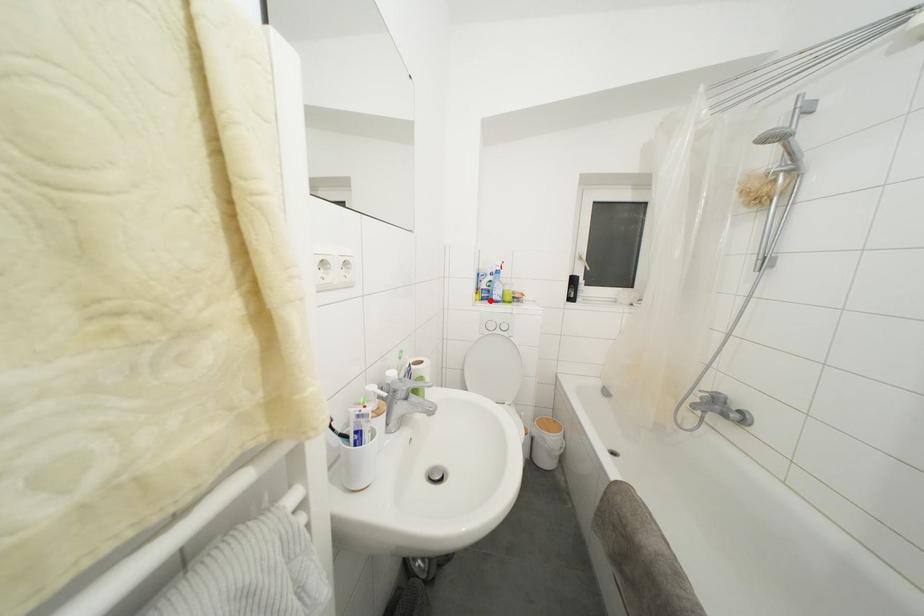
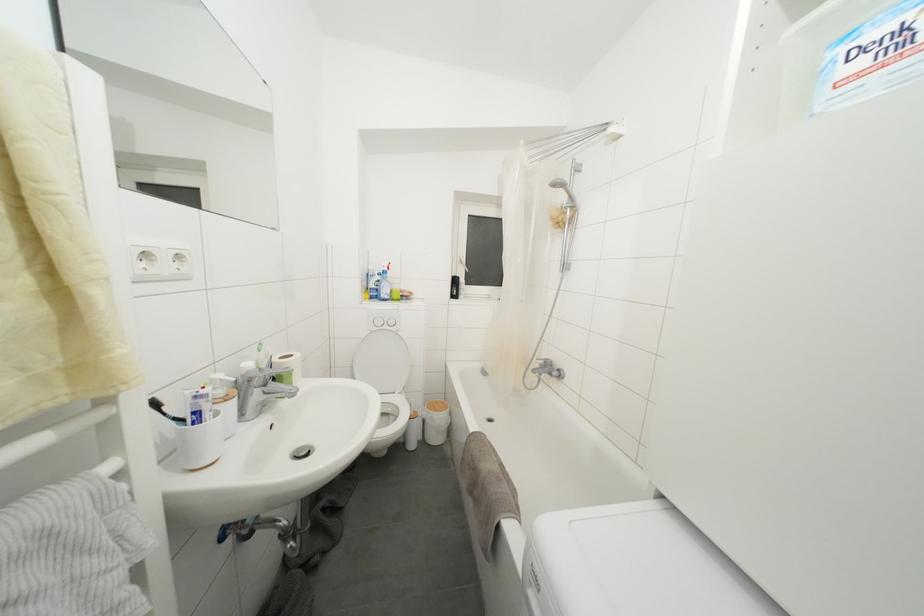
Where in the second image is the point corresponding to the highlighted location from the first image?

(379, 300)